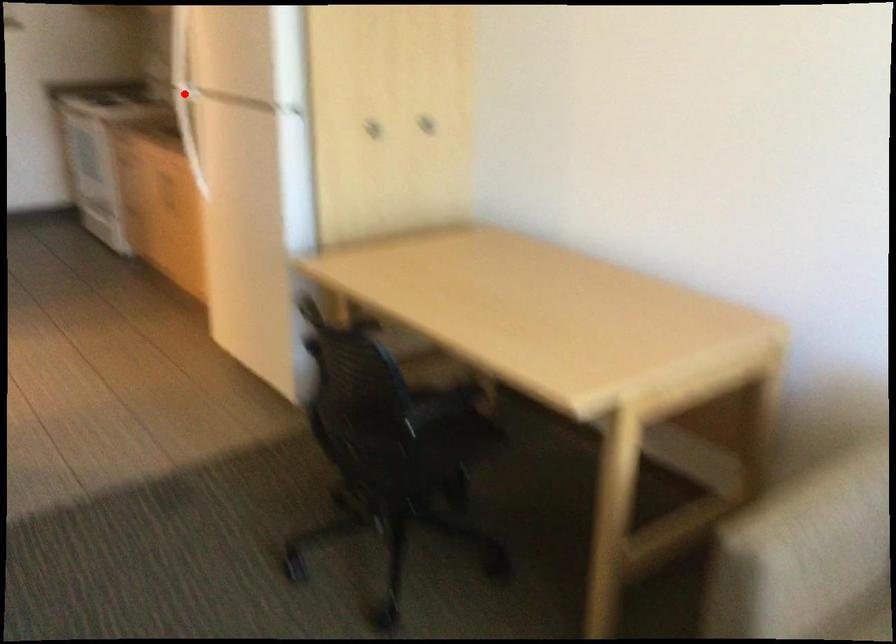
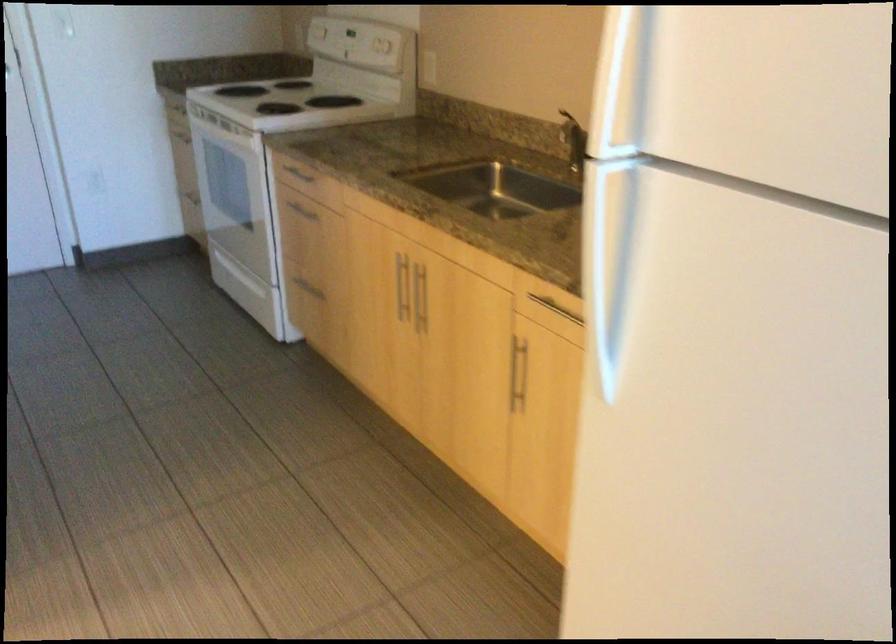
Question: I am providing you with two images of the same scene from different viewpoints. A red point is marked on the first image. At the location where the point appears in image 1, is it still visible in image 2?

Choices:
 (A) Yes
 (B) No

Answer: (B)